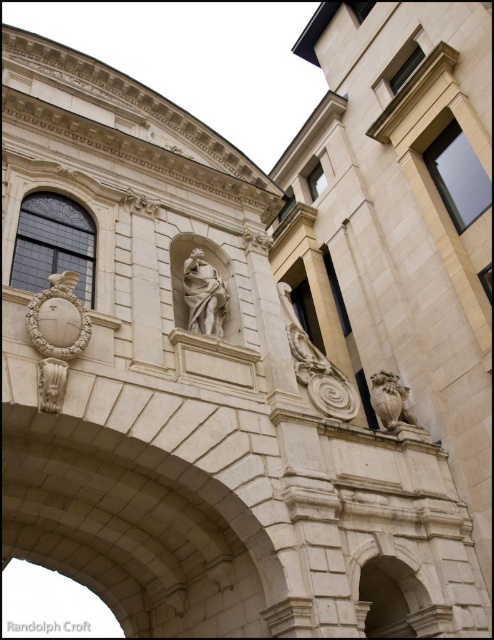
You are an art student analyzing the classical structure. You notice the white marble statue at center and the matte stone sculpture at lower left. Which one is taller?

The white marble statue at center is taller than the matte stone sculpture at lower left.

You are standing in front of the classical arch structure and want to determine the relative positions of two points marked on the arch. Which point, point (204, 280) or point (40, 396), is closer to you?

Point (204, 280) is closer to you because it is further to the viewer than point (40, 396).